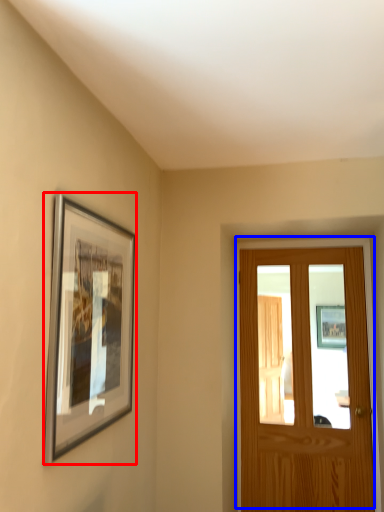
Question: Which object appears closest to the camera in this image, picture frame (highlighted by a red box) or door (highlighted by a blue box)?

Choices:
 (A) picture frame
 (B) door

Answer: (A)